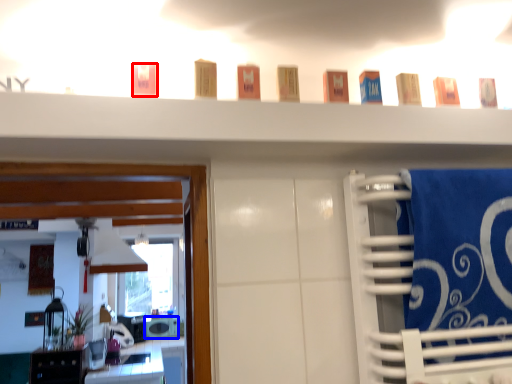
Question: Which of the following is the closest to the observer, toiletry (highlighted by a red box) or appliance (highlighted by a blue box)?

Choices:
 (A) toiletry
 (B) appliance

Answer: (A)